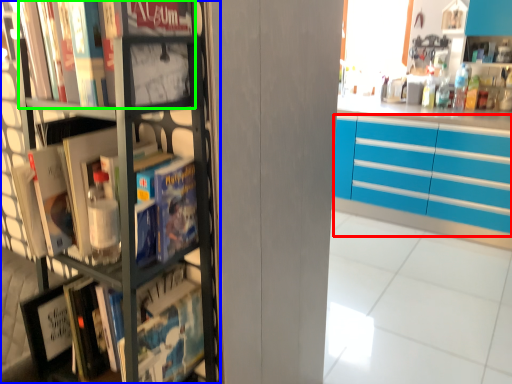
Question: Which is farther away from cabinetry (highlighted by a red box)? bookcase (highlighted by a blue box) or book (highlighted by a green box)?

Choices:
 (A) bookcase
 (B) book

Answer: (B)